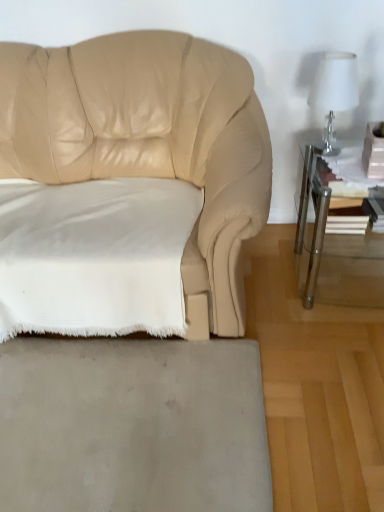
Question: Is white soft fabric pillow at lower left to the right of clear glass table lamp at upper right from the viewer's perspective?

Choices:
 (A) no
 (B) yes

Answer: (A)

Question: From a real-world perspective, is white soft fabric pillow at lower left on clear glass table lamp at upper right?

Choices:
 (A) yes
 (B) no

Answer: (B)

Question: Is white soft fabric pillow at lower left thinner than clear glass table lamp at upper right?

Choices:
 (A) yes
 (B) no

Answer: (B)

Question: Is white soft fabric pillow at lower left taller than clear glass table lamp at upper right?

Choices:
 (A) no
 (B) yes

Answer: (B)

Question: From the image's perspective, is white soft fabric pillow at lower left under clear glass table lamp at upper right?

Choices:
 (A) yes
 (B) no

Answer: (A)

Question: Can you confirm if white soft fabric pillow at lower left is shorter than clear glass table lamp at upper right?

Choices:
 (A) yes
 (B) no

Answer: (B)

Question: Is the depth of clear glass table at right less than that of clear glass table lamp at upper right?

Choices:
 (A) no
 (B) yes

Answer: (B)

Question: Considering the relative sizes of clear glass table at right and clear glass table lamp at upper right in the image provided, is clear glass table at right taller than clear glass table lamp at upper right?

Choices:
 (A) no
 (B) yes

Answer: (B)

Question: Can you confirm if clear glass table at right is smaller than clear glass table lamp at upper right?

Choices:
 (A) no
 (B) yes

Answer: (A)

Question: Is clear glass table at right looking in the opposite direction of clear glass table lamp at upper right?

Choices:
 (A) no
 (B) yes

Answer: (A)

Question: Can you confirm if clear glass table at right is bigger than clear glass table lamp at upper right?

Choices:
 (A) no
 (B) yes

Answer: (B)

Question: Would you say clear glass table at right is outside clear glass table lamp at upper right?

Choices:
 (A) no
 (B) yes

Answer: (B)

Question: Is gray matte rug at lower center not inside clear glass table at right?

Choices:
 (A) yes
 (B) no

Answer: (A)